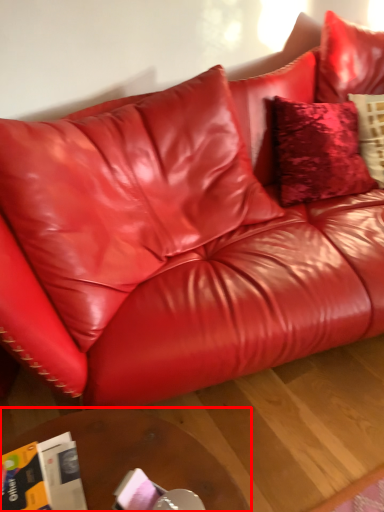
Question: Considering the relative positions of table (annotated by the red box) and magazine in the image provided, where is table (annotated by the red box) located with respect to the staircase?

Choices:
 (A) right
 (B) left

Answer: (A)